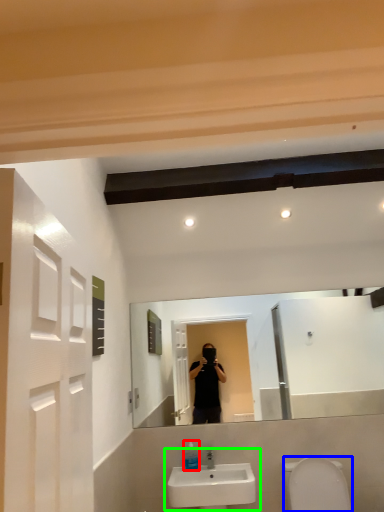
Question: Based on their relative distances, which object is nearer to soap dispenser (highlighted by a red box)? Choose from toilet bowl (highlighted by a blue box) and sink (highlighted by a green box).

Choices:
 (A) toilet bowl
 (B) sink

Answer: (B)